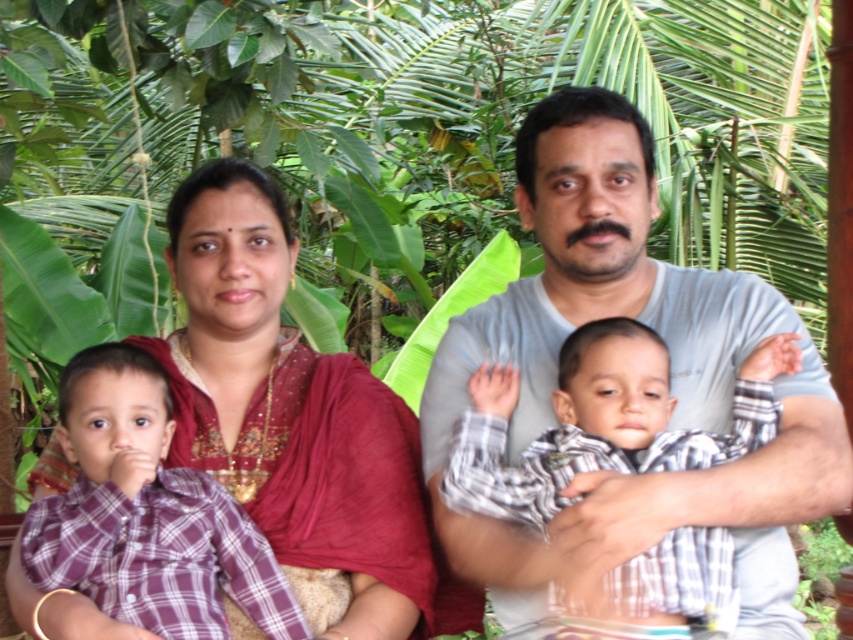
Consider the image. Which is more to the right, matte red saree at center or plaid cotton shirt at center?

plaid cotton shirt at center is more to the right.

Between matte red saree at center and plaid cotton shirt at center, which one has more height?

Standing taller between the two is matte red saree at center.

Does point (263, 225) come in front of point (679, 534)?

No, it is not.

You are a GUI agent. You are given a task and a screenshot of the screen. Output one action in this format:
    pyautogui.click(x=<x>, y=<y>)
    Task: Click on the matte red saree at center
    
    Given the screenshot: What is the action you would take?
    pyautogui.click(x=289, y=408)

Does gray cotton shirt at center appear on the right side of matte red saree at center?

Correct, you'll find gray cotton shirt at center to the right of matte red saree at center.

Is gray cotton shirt at center to the left of matte red saree at center from the viewer's perspective?

In fact, gray cotton shirt at center is to the right of matte red saree at center.

Which is behind, point (769, 572) or point (280, 230)?

The point (280, 230) is behind.

Image resolution: width=853 pixels, height=640 pixels. In order to click on gray cotton shirt at center in this screenshot , I will do `click(671, 381)`.

Which is more to the right, matte red saree at center or purple plaid shirt at left?

Positioned to the right is matte red saree at center.

Between matte red saree at center and purple plaid shirt at left, which one appears on the left side from the viewer's perspective?

Positioned to the left is purple plaid shirt at left.

I want to click on matte red saree at center, so click(x=289, y=408).

Locate an element on the screen. matte red saree at center is located at coordinates (289, 408).